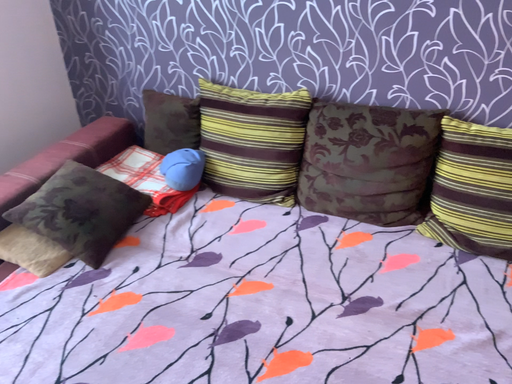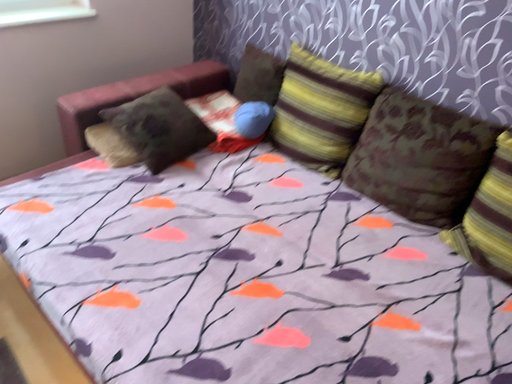
Question: How did the camera likely rotate when shooting the video?

Choices:
 (A) rotated right
 (B) rotated left

Answer: (B)